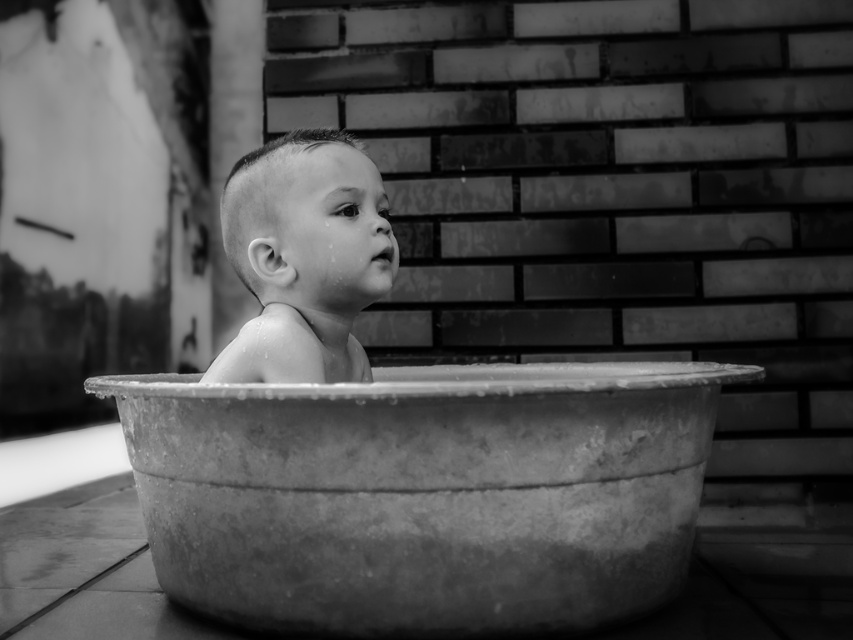
You are a photographer who wants to capture a closeup of the smooth skin baby at center without the metallic tub at center appearing in the frame. Is it possible to do so based on their positions?

The metallic tub at center is positioned on the right side of smooth skin baby at center, so you can adjust your angle to exclude the tub from the frame by moving to the left side of the baby.

Where is the metallic tub at center located in the image?

The metallic tub at center is located at point (424, 493).